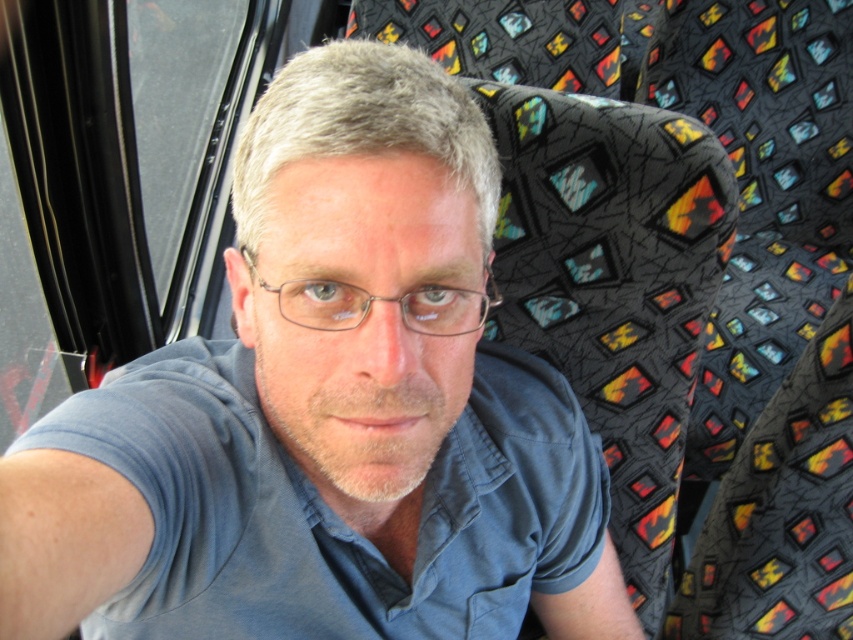
Question: Is blue cotton shirt at center below clear plastic glasses at center?

Choices:
 (A) yes
 (B) no

Answer: (A)

Question: Which object appears closest to the camera in this image?

Choices:
 (A) clear plastic glasses at center
 (B) blue cotton shirt at center

Answer: (B)

Question: Does blue cotton shirt at center have a lesser width compared to clear plastic glasses at center?

Choices:
 (A) no
 (B) yes

Answer: (A)

Question: Which of the following is the closest to the observer?

Choices:
 (A) clear plastic glasses at center
 (B) blue cotton shirt at center

Answer: (B)

Question: Is blue cotton shirt at center smaller than clear plastic glasses at center?

Choices:
 (A) yes
 (B) no

Answer: (B)